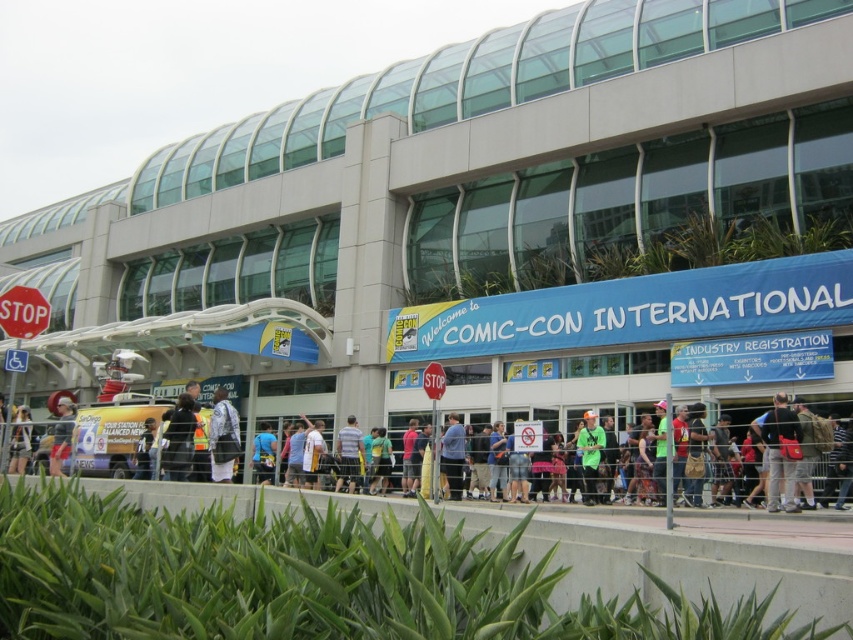
Question: Which object is farther from the camera taking this photo?

Choices:
 (A) dark gray backpack at center
 (B) striped shirt at center

Answer: (B)

Question: In this image, where is dark gray backpack at center located relative to green fabric shirt at center?

Choices:
 (A) right
 (B) left

Answer: (B)

Question: Observing the image, what is the correct spatial positioning of green fabric shirt at center in reference to blue shirt at center?

Choices:
 (A) left
 (B) right

Answer: (B)

Question: Which object is the farthest from the dark gray backpack at center?

Choices:
 (A) white textured jacket at center
 (B) red plastic stop sign at left
 (C) blue fabric shirt at center
 (D) striped shirt at center

Answer: (C)

Question: Does blue shirt at center have a lesser width compared to blue fabric shirt at center?

Choices:
 (A) no
 (B) yes

Answer: (B)

Question: Which point is farther from the camera taking this photo?

Choices:
 (A) (225, 448)
 (B) (189, 468)
 (C) (16, 468)

Answer: (C)